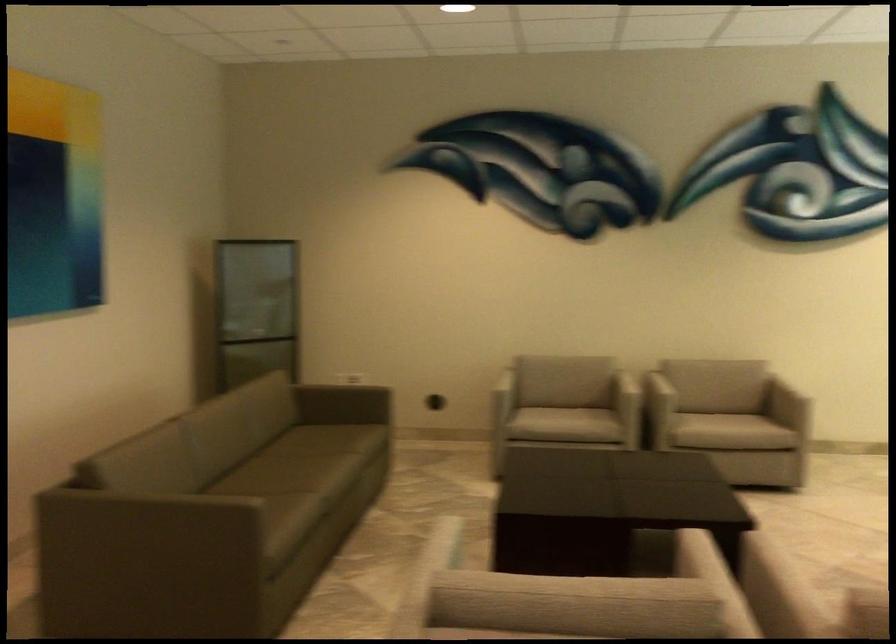
Identify the location of brown sofa armrest. Image resolution: width=896 pixels, height=644 pixels. (138, 500).